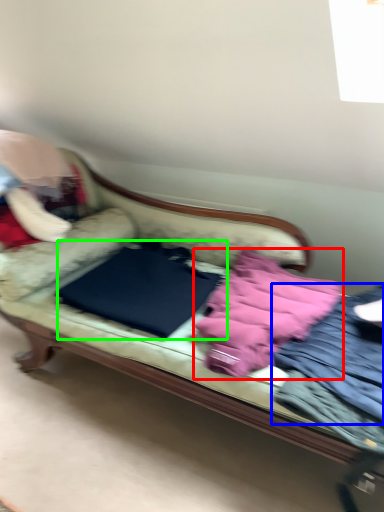
Question: Which is farther away from material (highlighted by a red box)? clothing (highlighted by a blue box) or sheet (highlighted by a green box)?

Choices:
 (A) clothing
 (B) sheet

Answer: (B)